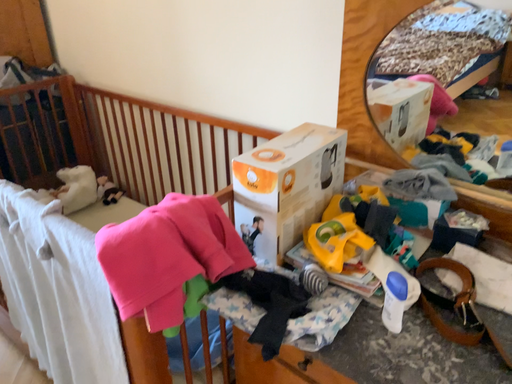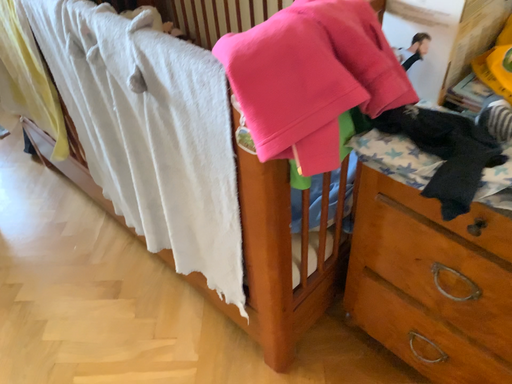
Question: How did the camera likely rotate when shooting the video?

Choices:
 (A) rotated downward
 (B) rotated upward

Answer: (A)